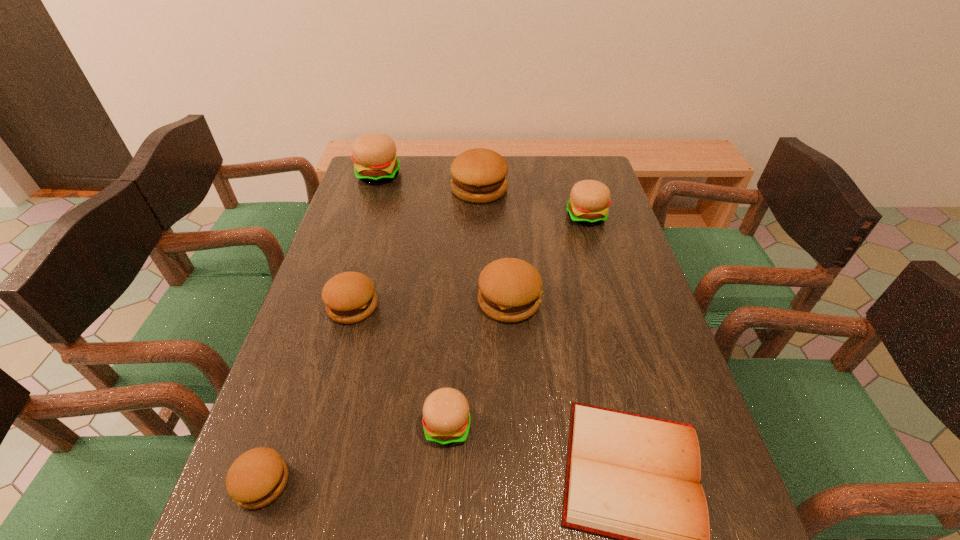
At what (x,y) coordinates should I click in order to perform the action: click on the biggest beige hamburger. Please return your answer as a coordinate pair (x, y). Looking at the image, I should click on (374, 154).

The width and height of the screenshot is (960, 540). Find the location of `the farthest beige hamburger`. the farthest beige hamburger is located at coordinates point(374,154).

This screenshot has height=540, width=960. Find the location of `the farthest brown hamburger`. the farthest brown hamburger is located at coordinates (479, 174).

At what (x,y) coordinates should I click in order to perform the action: click on the second smallest beige hamburger. Please return your answer as a coordinate pair (x, y). The width and height of the screenshot is (960, 540). Looking at the image, I should click on (589, 199).

At what (x,y) coordinates should I click in order to perform the action: click on the second farthest beige hamburger. Please return your answer as a coordinate pair (x, y). Looking at the image, I should click on (589, 199).

Locate an element on the screen. This screenshot has width=960, height=540. the third smallest brown hamburger is located at coordinates (510, 289).

What are the coordinates of `the third biggest brown hamburger` in the screenshot? It's located at coord(349,297).

Where is `the nearest beige hamburger`? This screenshot has width=960, height=540. the nearest beige hamburger is located at coordinates pos(446,420).

Find the location of a particular element. This screenshot has width=960, height=540. the second beige hamburger from left to right is located at coordinates (446, 420).

Where is `the nearest brown hamburger`? the nearest brown hamburger is located at coordinates (256, 478).